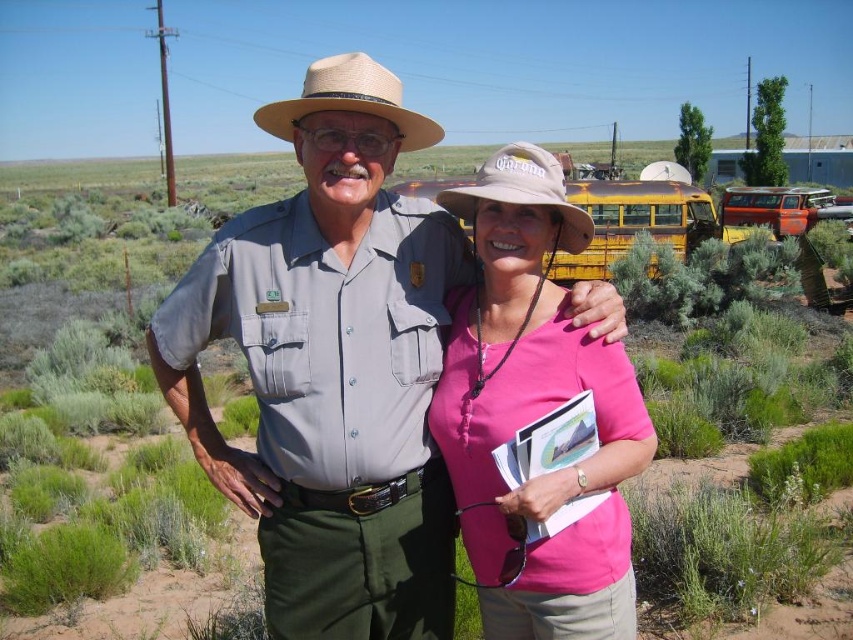
Question: Is matte khaki uniform at center smaller than rusty metal bus at upper center?

Choices:
 (A) no
 (B) yes

Answer: (B)

Question: Among these objects, which one is nearest to the camera?

Choices:
 (A) tan straw cowboy hat at center
 (B) pink fabric shirt at center
 (C) matte khaki uniform at center

Answer: (B)

Question: Observing the image, what is the correct spatial positioning of matte khaki uniform at center in reference to pink fabric shirt at center?

Choices:
 (A) below
 (B) above

Answer: (B)

Question: Which of these objects is positioned farthest from the pink fabric shirt at center?

Choices:
 (A) rusty metal bus at upper center
 (B) tan fabric cowboy hat at center

Answer: (A)

Question: Does rusty metal bus at upper center have a smaller size compared to tan fabric cowboy hat at center?

Choices:
 (A) yes
 (B) no

Answer: (B)

Question: Which of these objects is positioned closest to the tan fabric cowboy hat at center?

Choices:
 (A) rusty metal bus at upper center
 (B) tan straw cowboy hat at center

Answer: (B)